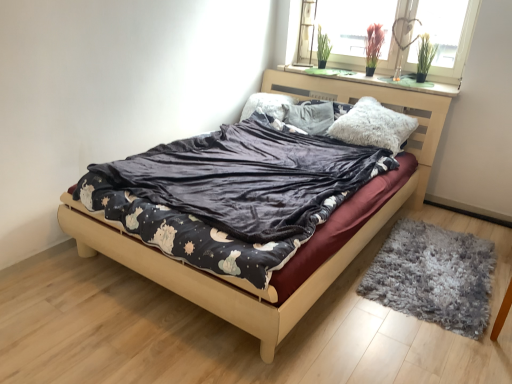
What is the approximate width of glass window at upper right?

The width of glass window at upper right is 3.36 inches.

This screenshot has width=512, height=384. Identify the location of glass window at upper right. (404, 35).

What do you see at coordinates (302, 249) in the screenshot? The height and width of the screenshot is (384, 512). I see `velvet dark blue bed at center` at bounding box center [302, 249].

Where is `gray shaggy rug at lower right`? Image resolution: width=512 pixels, height=384 pixels. gray shaggy rug at lower right is located at coordinates (434, 276).

Is fluffy white pillow at upper center, the 2th pillow from the front, bigger than glass window at upper right?

No.

Is fluffy white pillow at upper center, the 2th pillow from the right, spatially inside glass window at upper right, or outside of it?

fluffy white pillow at upper center, the 2th pillow from the right, exists outside the volume of glass window at upper right.

Which object is more forward, fluffy white pillow at upper center, the 2th pillow from the front, or glass window at upper right?

glass window at upper right is closer to the camera.

In the scene shown: Which of these two, fluffy white pillow at upper center, which is the 1th pillow from left to right, or glass window at upper right, is wider?

With larger width is fluffy white pillow at upper center, which is the 1th pillow from left to right.

Identify the location of mat in front of the green glass window sill at upper right. (434, 276).

Considering the sizes of objects gray shaggy rug at lower right and green glass window sill at upper right in the image provided, who is shorter, gray shaggy rug at lower right or green glass window sill at upper right?

green glass window sill at upper right.

From the picture: From a real-world perspective, who is located higher, gray shaggy rug at lower right or green glass window sill at upper right?

green glass window sill at upper right is physically above.

Could green glass window sill at upper right be considered to be inside gray shaggy rug at lower right?

No, green glass window sill at upper right is not surrounded by gray shaggy rug at lower right.

Do you think velvet dark gray blanket at center is within fluffy white pillow at upper center, the 2th pillow from the front, or outside of it?

The correct answer is: outside.

Considering the sizes of objects velvet dark gray blanket at center and fluffy white pillow at upper center, the 2th pillow from the right, in the image provided, who is smaller, velvet dark gray blanket at center or fluffy white pillow at upper center, the 2th pillow from the right,?

fluffy white pillow at upper center, the 2th pillow from the right.

Considering the relative sizes of velvet dark gray blanket at center and fluffy white pillow at upper center, which ranks as the 1th pillow in back-to-front order, in the image provided, is velvet dark gray blanket at center shorter than fluffy white pillow at upper center, which ranks as the 1th pillow in back-to-front order,?

Correct, velvet dark gray blanket at center is not as tall as fluffy white pillow at upper center, which ranks as the 1th pillow in back-to-front order.

Considering the sizes of objects fluffy white pillow at center, the first pillow from the right, and glass window at upper right in the image provided, who is thinner, fluffy white pillow at center, the first pillow from the right, or glass window at upper right?

Thinner between the two is glass window at upper right.

From the image's perspective, is fluffy white pillow at center, the 2th pillow from the back, positioned above or below glass window at upper right?

fluffy white pillow at center, the 2th pillow from the back, is below glass window at upper right.

Is fluffy white pillow at center, the 2th pillow positioned from the left, turned away from glass window at upper right?

No, fluffy white pillow at center, the 2th pillow positioned from the left, is not facing the opposite direction of glass window at upper right.

How far apart are fluffy white pillow at center, the 2th pillow from the back, and glass window at upper right?

A distance of 26.04 inches exists between fluffy white pillow at center, the 2th pillow from the back, and glass window at upper right.

Is velvet dark gray blanket at center oriented away from gray shaggy rug at lower right?

That's not correct — velvet dark gray blanket at center is not looking away from gray shaggy rug at lower right.

Between velvet dark gray blanket at center and gray shaggy rug at lower right, which one has larger width?

With larger width is velvet dark gray blanket at center.

From the image's perspective, which one is positioned lower, velvet dark gray blanket at center or gray shaggy rug at lower right?

gray shaggy rug at lower right appears lower in the image.

From a real-world perspective, between velvet dark gray blanket at center and gray shaggy rug at lower right, who is vertically lower?

gray shaggy rug at lower right is physically lower.

How many degrees apart are the facing directions of glass window at upper right and fluffy white pillow at upper center, the 2th pillow from the front?

glass window at upper right and fluffy white pillow at upper center, the 2th pillow from the front, are facing 1.03 degrees away from each other.

Considering the relative sizes of glass window at upper right and fluffy white pillow at upper center, which ranks as the 1th pillow in back-to-front order, in the image provided, is glass window at upper right taller than fluffy white pillow at upper center, which ranks as the 1th pillow in back-to-front order,?

Indeed, glass window at upper right has a greater height compared to fluffy white pillow at upper center, which ranks as the 1th pillow in back-to-front order.

From the image's perspective, is glass window at upper right on fluffy white pillow at upper center, the 2th pillow from the front?

Yes, from the image's perspective, glass window at upper right is above fluffy white pillow at upper center, the 2th pillow from the front.

Is point (390, 13) farther from viewer compared to point (248, 101)?

No, (390, 13) is closer to viewer.

Is velvet dark gray blanket at center placed right next to glass window at upper right?

No, velvet dark gray blanket at center is not with glass window at upper right.

Does velvet dark gray blanket at center have a greater width compared to glass window at upper right?

Yes.

Is velvet dark gray blanket at center at the right side of glass window at upper right?

No, velvet dark gray blanket at center is not to the right of glass window at upper right.

Is velvet dark gray blanket at center outside of glass window at upper right?

Yes, velvet dark gray blanket at center is not within glass window at upper right.

I want to click on window in front of the fluffy white pillow at upper center, which is the 1th pillow from left to right, so click(x=404, y=35).

Find the location of a particular element. The image size is (512, 384). window sill that appears above the gray shaggy rug at lower right (from a real-world perspective) is located at coordinates pos(376,80).

From the image, which object appears to be farther from velvet dark blue bed at center, glass window at upper right or fluffy white pillow at upper center, which ranks as the 1th pillow in back-to-front order?

The object further to velvet dark blue bed at center is glass window at upper right.

Which object lies nearer to the anchor point fluffy white pillow at center, the 2th pillow from the back, green glass window sill at upper right or velvet dark blue bed at center?

green glass window sill at upper right.

Estimate the real-world distances between objects in this image. Which object is further from gray shaggy rug at lower right, velvet dark blue bed at center or velvet dark gray blanket at center?

velvet dark gray blanket at center.

Looking at the image, which one is located further to fluffy white pillow at center, which ranks as the first pillow in front-to-back order, fluffy white pillow at upper center, which ranks as the 1th pillow in back-to-front order, or velvet dark blue bed at center?

Based on the image, velvet dark blue bed at center appears to be further to fluffy white pillow at center, which ranks as the first pillow in front-to-back order.

Based on their spatial positions, is velvet dark blue bed at center or fluffy white pillow at center, the 2th pillow positioned from the left, further from velvet dark gray blanket at center?

fluffy white pillow at center, the 2th pillow positioned from the left, lies further to velvet dark gray blanket at center than the other object.

When comparing their distances from velvet dark blue bed at center, does green glass window sill at upper right or fluffy white pillow at center, the first pillow from the right, seem closer?

Among the two, fluffy white pillow at center, the first pillow from the right, is located nearer to velvet dark blue bed at center.

Based on their spatial positions, is fluffy white pillow at upper center, which is the 1th pillow from left to right, or velvet dark gray blanket at center closer to green glass window sill at upper right?

The object closer to green glass window sill at upper right is fluffy white pillow at upper center, which is the 1th pillow from left to right.

Which object lies further to the anchor point velvet dark blue bed at center, gray shaggy rug at lower right or green glass window sill at upper right?

The object further to velvet dark blue bed at center is green glass window sill at upper right.

Where is `mat between velvet dark blue bed at center and glass window at upper right in the front-back direction`? This screenshot has height=384, width=512. mat between velvet dark blue bed at center and glass window at upper right in the front-back direction is located at coordinates (434, 276).

Where is `pillow between velvet dark gray blanket at center and glass window at upper right from front to back`? The image size is (512, 384). pillow between velvet dark gray blanket at center and glass window at upper right from front to back is located at coordinates (373, 126).

The width and height of the screenshot is (512, 384). I want to click on window sill positioned between velvet dark gray blanket at center and fluffy white pillow at upper center, the 2th pillow from the front, from near to far, so click(376, 80).

You are a GUI agent. You are given a task and a screenshot of the screen. Output one action in this format:
    pyautogui.click(x=<x>, y=<y>)
    Task: Click on the window positioned between velvet dark gray blanket at center and fluffy white pillow at upper center, which is the 1th pillow from left to right, from near to far
    This screenshot has height=384, width=512.
    Given the screenshot: What is the action you would take?
    pyautogui.click(x=404, y=35)